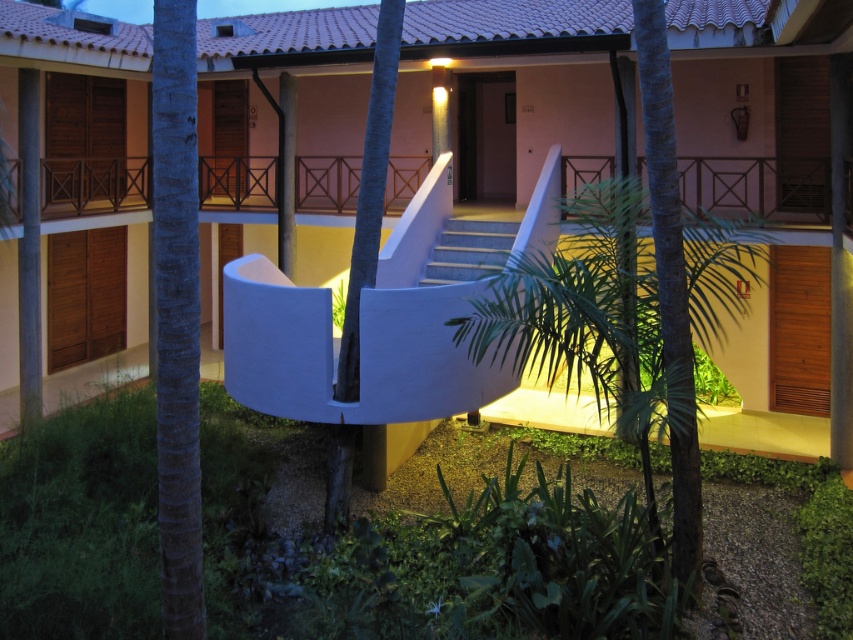
Question: From the image, what is the correct spatial relationship of white concrete staircase at center in relation to green leafy palm tree at center?

Choices:
 (A) above
 (B) below

Answer: (A)

Question: Which is nearer to the dark blue bark at left?

Choices:
 (A) green leafy palm tree at center
 (B) green textured palm tree at right

Answer: (A)

Question: Estimate the real-world distances between objects in this image. Which object is farther from the green leafy tree at center?

Choices:
 (A) green textured palm tree at right
 (B) white concrete staircase at center
 (C) dark blue bark at left

Answer: (B)

Question: Can you confirm if white concrete staircase at center is thinner than dark blue bark at left?

Choices:
 (A) no
 (B) yes

Answer: (A)

Question: Which of the following is the farthest from the observer?

Choices:
 (A) (115, 92)
 (B) (171, 458)
 (C) (686, 426)
 (D) (341, 429)

Answer: (A)

Question: Considering the relative positions of white concrete staircase at center and green leafy tree at center in the image provided, where is white concrete staircase at center located with respect to green leafy tree at center?

Choices:
 (A) above
 (B) below

Answer: (A)